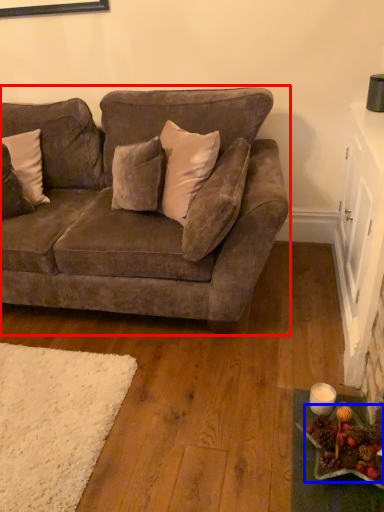
Question: Which of the following is the farthest to the observer, studio couch (highlighted by a red box) or food (highlighted by a blue box)?

Choices:
 (A) studio couch
 (B) food

Answer: (A)